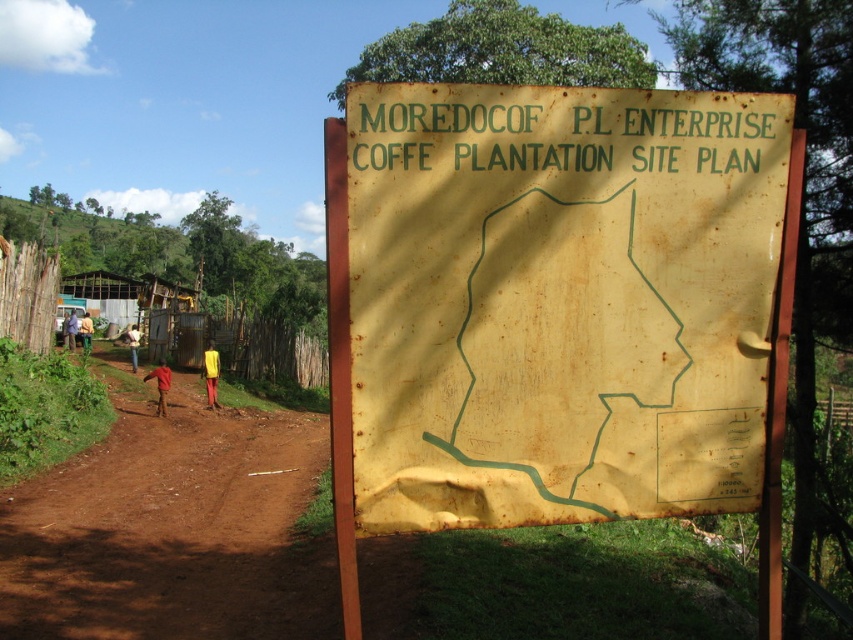
From the picture: Is yellow fabric at center positioned in front of yellow shirt at left?

Yes, yellow fabric at center is closer to the viewer.

Can you confirm if yellow fabric at center is positioned above yellow shirt at left?

No, yellow fabric at center is not above yellow shirt at left.

Locate an element on the screen. yellow fabric at center is located at coordinates (212, 372).

Between rusty yellow map at center and yellow fabric pants at left, which one is positioned lower?

Positioned lower is yellow fabric pants at left.

From the picture: Can you confirm if rusty yellow map at center is shorter than yellow fabric pants at left?

No, rusty yellow map at center is not shorter than yellow fabric pants at left.

The height and width of the screenshot is (640, 853). In order to click on rusty yellow map at center in this screenshot , I will do `click(556, 308)`.

Identify the location of rusty yellow map at center. (556, 308).

Describe the element at coordinates (132, 344) in the screenshot. I see `yellow fabric pants at left` at that location.

Who is lower down, yellow fabric pants at left or yellow fabric shirt at center?

yellow fabric pants at left

Which is in front, point (126, 332) or point (91, 323)?

Point (126, 332) is more forward.

Where is `yellow fabric pants at left`? This screenshot has width=853, height=640. yellow fabric pants at left is located at coordinates (132, 344).